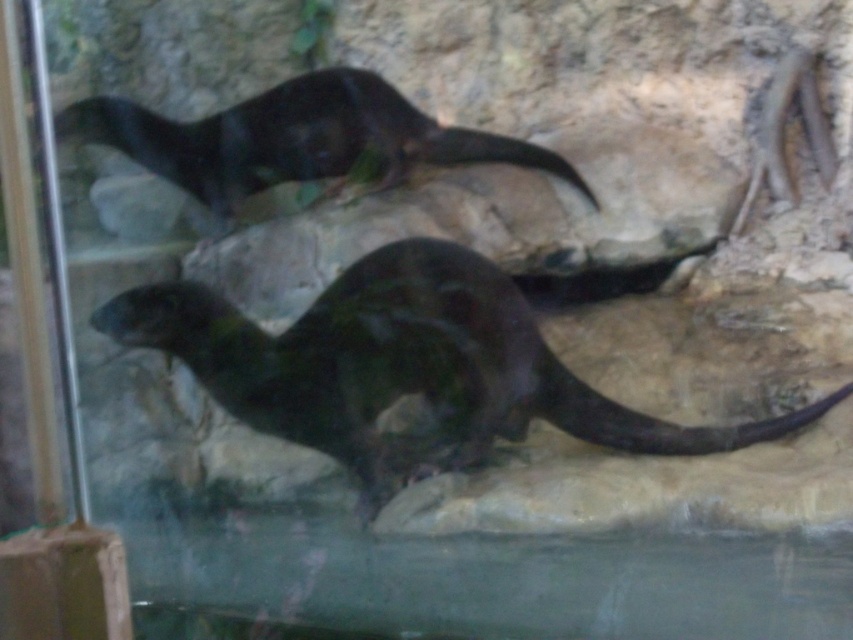
Question: Considering the relative positions of shiny black otter at center and shiny black otter at upper center in the image provided, where is shiny black otter at center located with respect to shiny black otter at upper center?

Choices:
 (A) above
 (B) below

Answer: (B)

Question: Does shiny black otter at center appear on the right side of shiny black otter at upper center?

Choices:
 (A) no
 (B) yes

Answer: (B)

Question: Does shiny black otter at center appear on the right side of shiny black otter at upper center?

Choices:
 (A) no
 (B) yes

Answer: (B)